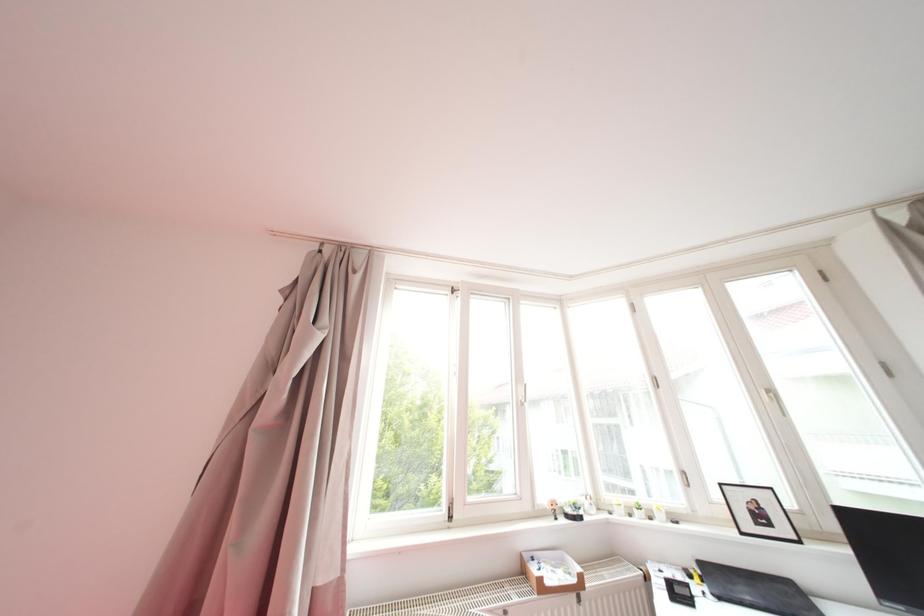
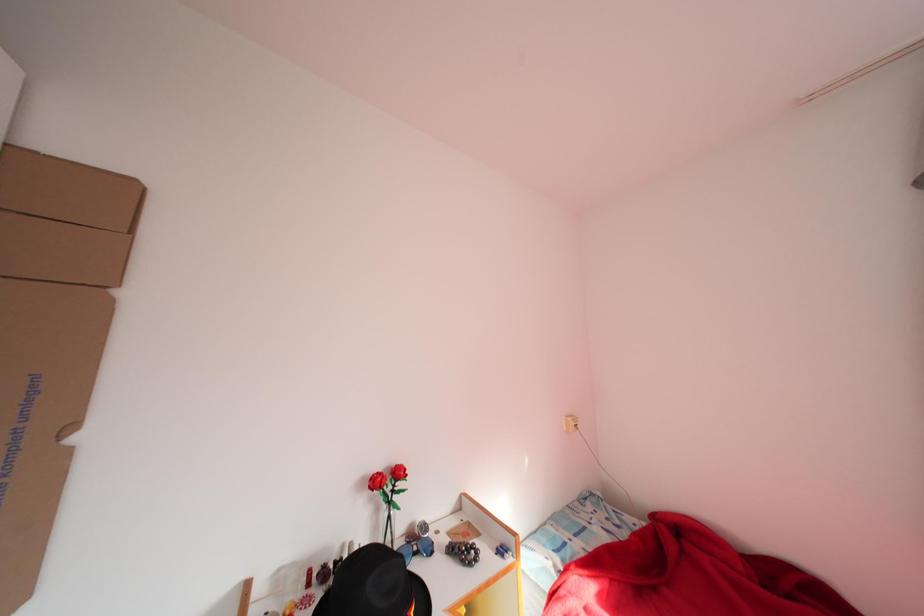
Question: The first image is from the beginning of the video and the second image is from the end. How did the camera likely rotate when shooting the video?

Choices:
 (A) Left
 (B) Right
 (C) Up
 (D) Down

Answer: (A)